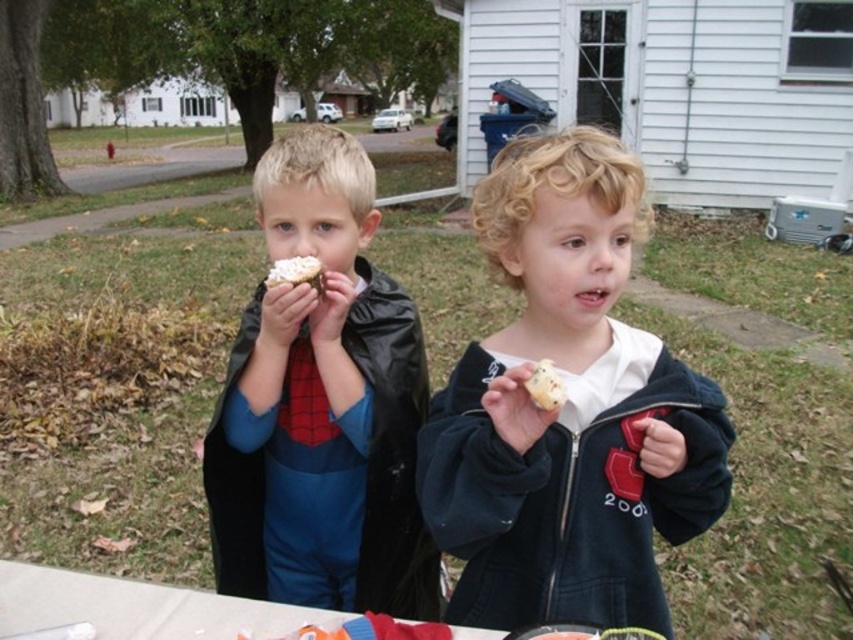
You are a photographer trying to capture a closeup of the white fluffy cupcake at center without the matte black cape at left blocking the view. Based on their sizes, which object would you need to adjust more to ensure the cupcake is fully visible?

The matte black cape at left is larger in size than the white fluffy cupcake at center, so you would need to adjust the position of the matte black cape at left more to ensure the cupcake is fully visible.

You are a delivery person trying to determine if the matte black jacket at center and the matte black cape at left can fit into a box that has a maximum capacity of 10 liters. Which object takes up more space, and will they both fit?

The matte black cape at left takes up more space than the matte black jacket at center. Since the matte black jacket at center occupies less space than the matte black cape at left, and the total space required is less than 10 liters, both items can fit into the box.